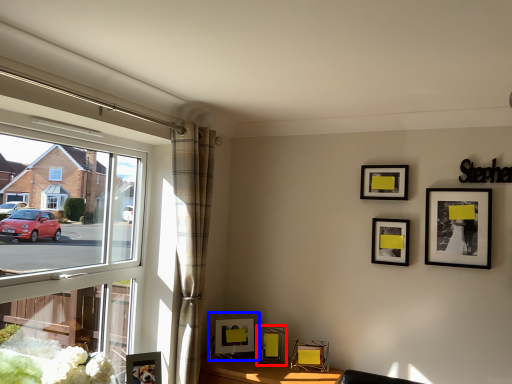
Question: Which point is closer to the camera, picture frame (highlighted by a red box) or picture frame (highlighted by a blue box)?

Choices:
 (A) picture frame
 (B) picture frame

Answer: (A)